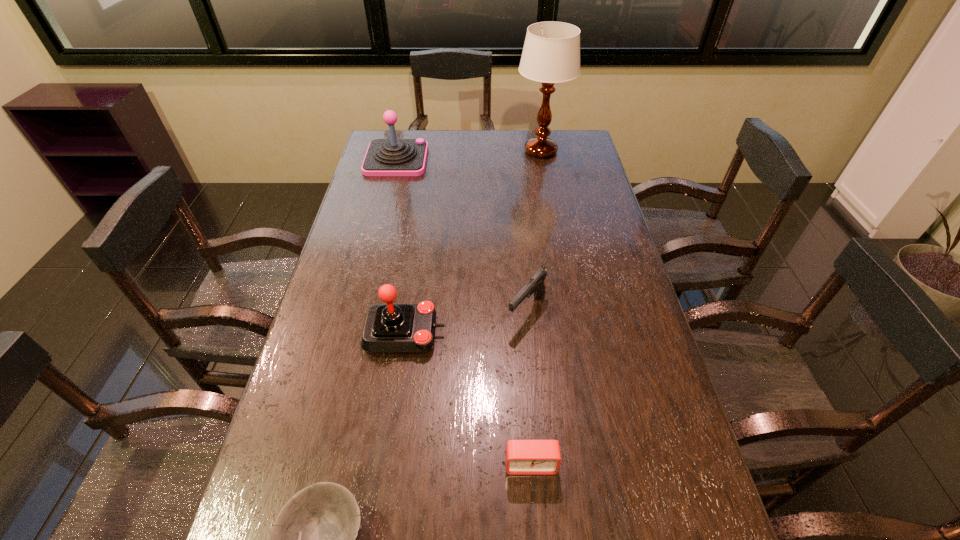
The width and height of the screenshot is (960, 540). Find the location of `table lamp at the far edge`. table lamp at the far edge is located at coordinates (551, 54).

Locate an element on the screen. This screenshot has width=960, height=540. joystick positioned at the far edge is located at coordinates (385, 157).

At what (x,y) coordinates should I click in order to perform the action: click on object positioned at the right edge. Please return your answer as a coordinate pair (x, y). Looking at the image, I should click on (551, 54).

The height and width of the screenshot is (540, 960). What are the coordinates of `object located in the far left corner section of the desktop` in the screenshot? It's located at (385, 157).

At what (x,y) coordinates should I click in order to perform the action: click on object that is positioned at the far right corner. Please return your answer as a coordinate pair (x, y). The width and height of the screenshot is (960, 540). Looking at the image, I should click on (551, 54).

The width and height of the screenshot is (960, 540). I want to click on vacant area at the left edge of the desktop, so click(324, 378).

You are a GUI agent. You are given a task and a screenshot of the screen. Output one action in this format:
    pyautogui.click(x=<x>, y=<y>)
    Task: Click on the vacant area at the right edge
    
    Given the screenshot: What is the action you would take?
    pyautogui.click(x=658, y=514)

At what (x,y) coordinates should I click in order to perform the action: click on vacant area at the far right corner. Please return your answer as a coordinate pair (x, y). This screenshot has width=960, height=540. Looking at the image, I should click on (579, 129).

Locate an element on the screen. This screenshot has width=960, height=540. vacant space that's between the alarm clock and the fourth tallest object is located at coordinates (529, 387).

Identify the location of free space that is in between the tallest object and the gun. (534, 231).